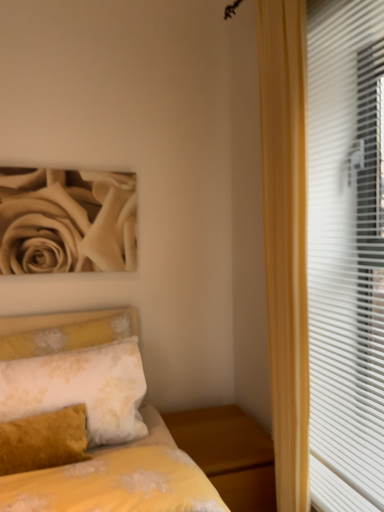
Question: Is white floral fabric pillow at lower left wider or thinner than white plastic blinds at right?

Choices:
 (A) thin
 (B) wide

Answer: (B)

Question: In the image, is white floral fabric pillow at lower left positioned in front of or behind white plastic blinds at right?

Choices:
 (A) front
 (B) behind

Answer: (B)

Question: Which object is the closest to the white plastic blinds at right?

Choices:
 (A) beige matte rose at upper left
 (B) wooden nightstand at lower right
 (C) white floral fabric pillow at lower left
 (D) yellow floral fabric bed at lower left

Answer: (B)

Question: Which object is positioned farthest from the white plastic blinds at right?

Choices:
 (A) beige matte rose at upper left
 (B) white floral fabric pillow at lower left
 (C) wooden nightstand at lower right
 (D) yellow floral fabric bed at lower left

Answer: (A)